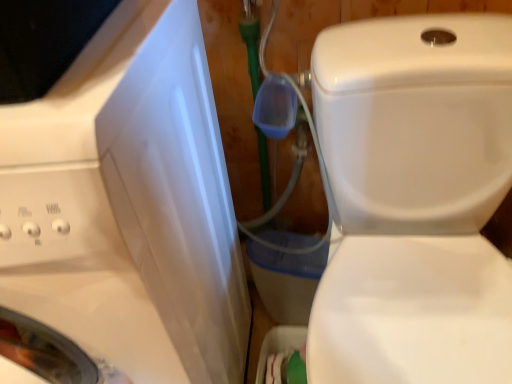
Question: Considering their positions, is white glossy toilet at center located in front of or behind white glossy washing machine at left?

Choices:
 (A) front
 (B) behind

Answer: (B)

Question: Visually, is white glossy toilet at center positioned to the left or to the right of white glossy washing machine at left?

Choices:
 (A) right
 (B) left

Answer: (A)

Question: Considering the positions of white glossy toilet at center and white glossy washing machine at left in the image, is white glossy toilet at center bigger or smaller than white glossy washing machine at left?

Choices:
 (A) big
 (B) small

Answer: (B)

Question: Looking at their shapes, would you say white glossy washing machine at left is wider or thinner than white glossy toilet at center?

Choices:
 (A) wide
 (B) thin

Answer: (B)

Question: Is white glossy washing machine at left situated inside white glossy toilet at center or outside?

Choices:
 (A) outside
 (B) inside

Answer: (A)

Question: In terms of size, does white glossy washing machine at left appear bigger or smaller than white glossy toilet at center?

Choices:
 (A) small
 (B) big

Answer: (B)

Question: Is white glossy washing machine at left taller or shorter than white glossy toilet at center?

Choices:
 (A) short
 (B) tall

Answer: (B)